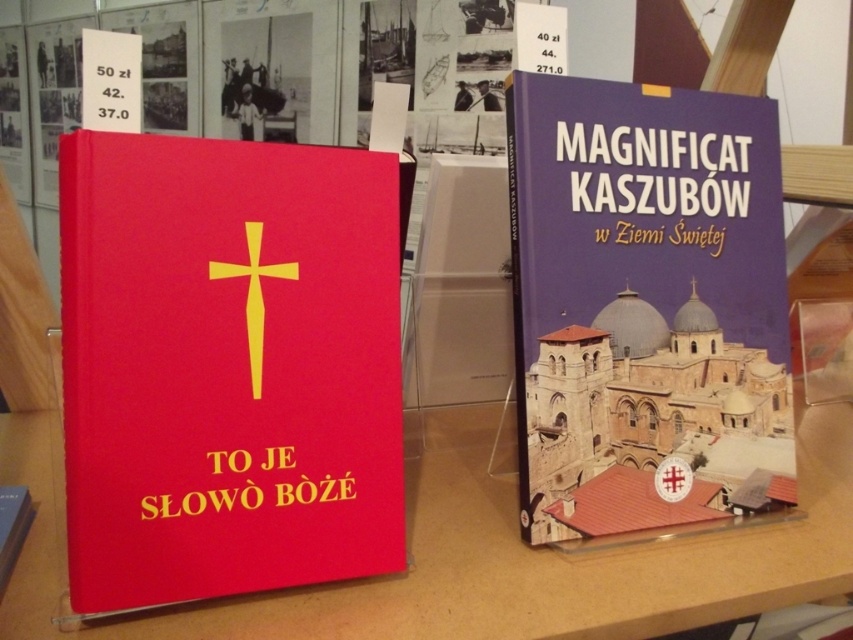
Question: Which of these objects is positioned farthest from the yellow matte cross at center?

Choices:
 (A) matte red book at center
 (B) purple matte book at center

Answer: (B)

Question: Is matte red book at center below yellow matte cross at center?

Choices:
 (A) yes
 (B) no

Answer: (A)

Question: Observing the image, what is the correct spatial positioning of matte red book at center in reference to matte red book at left?

Choices:
 (A) right
 (B) left

Answer: (B)

Question: Which object is positioned farthest from the yellow matte cross at center?

Choices:
 (A) matte red book at center
 (B) matte red book at left

Answer: (B)

Question: Which point is closer to the camera taking this photo?

Choices:
 (A) (166, 563)
 (B) (291, 275)

Answer: (A)

Question: Is matte red book at center positioned in front of matte red book at left?

Choices:
 (A) no
 (B) yes

Answer: (A)